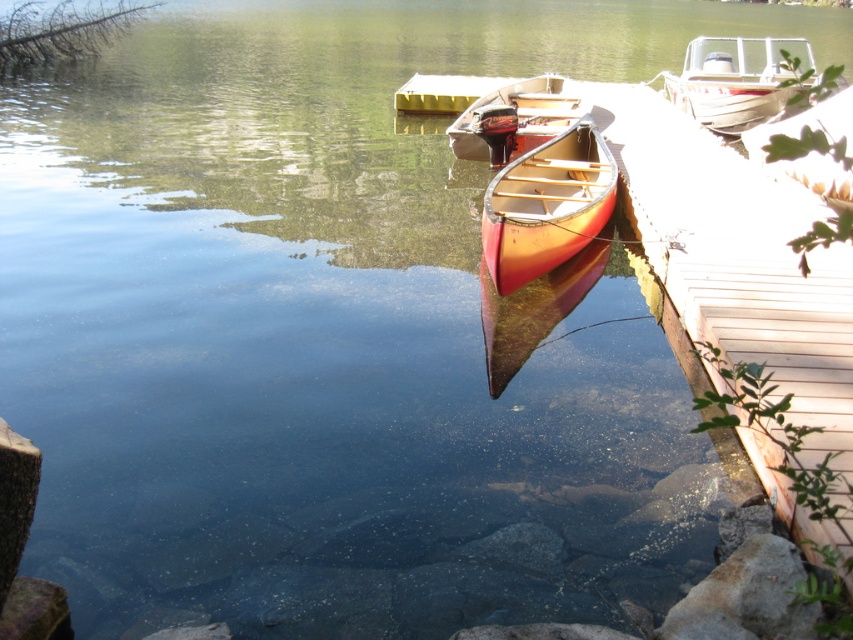
Can you confirm if matte wood canoe at center is positioned to the left of white matte boat at upper right?

Yes, matte wood canoe at center is to the left of white matte boat at upper right.

Is matte wood canoe at center to the right of white matte boat at upper right from the viewer's perspective?

In fact, matte wood canoe at center is to the left of white matte boat at upper right.

Where is `matte wood canoe at center`? The height and width of the screenshot is (640, 853). matte wood canoe at center is located at coordinates (546, 205).